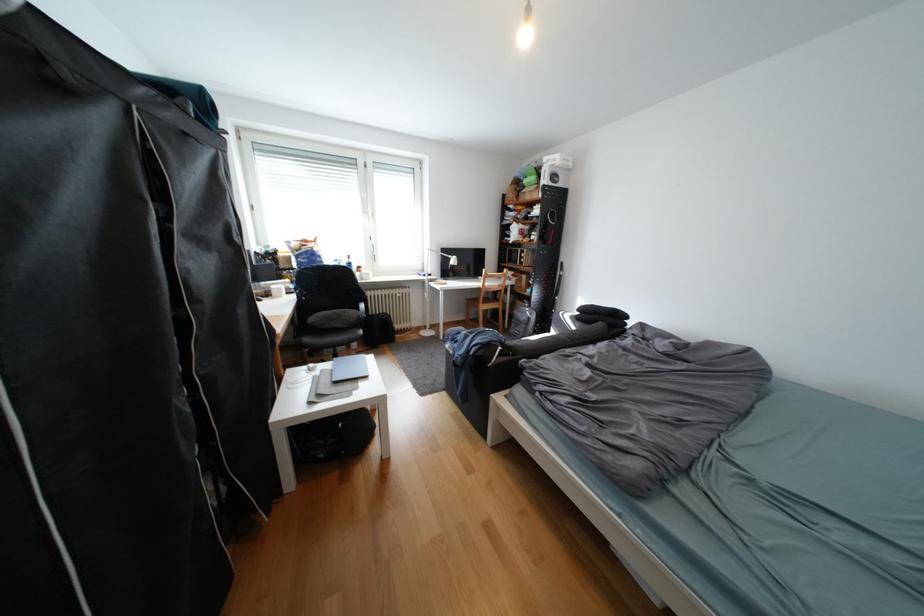
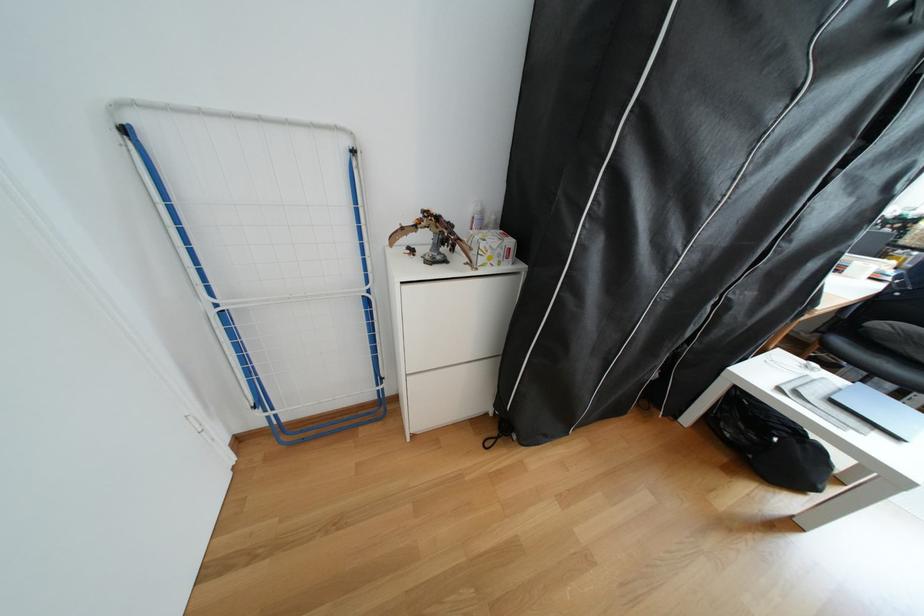
Locate, in the second image, the point that corresponds to point 334,456 in the first image.

(739, 436)